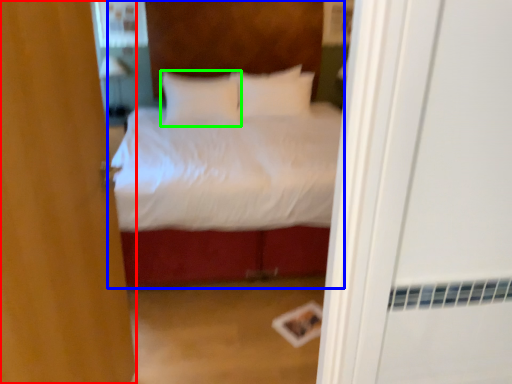
Question: Which is farther away from door (highlighted by a red box)? bed (highlighted by a blue box) or pillow (highlighted by a green box)?

Choices:
 (A) bed
 (B) pillow

Answer: (A)